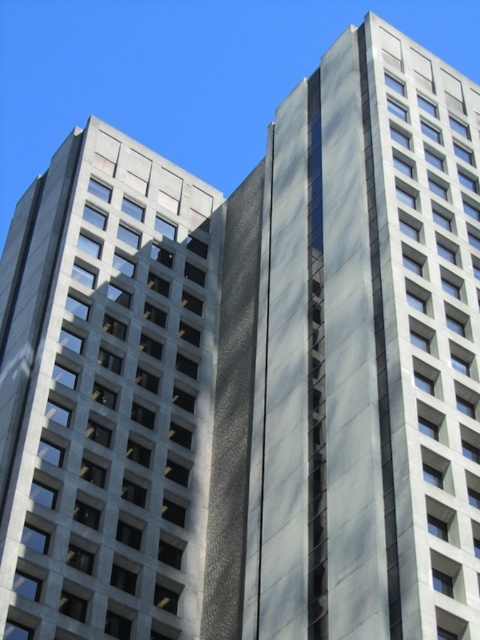
You are an architect planning to install a flagpole on the roof of one of the gray concrete buildings. The flagpole requires a minimum of 10 meters of clearance above the roof to comply with aviation safety regulations. Given that the gray concrete building at center is 120 meters tall and the gray concrete building at left is 110 meters tall, which building should you choose to install the flagpole?

The gray concrete building at center is taller than the gray concrete building at left. Since the building at center is 120 meters tall, installing the flagpole there would provide the required 10 meters of clearance above the roof for aviation safety regulations.

You are standing in front of the two gray concrete buildings. Which building, the gray concrete building at center or the gray concrete building at left, is closer to you?

The gray concrete building at center is closer to you because it is in front of the gray concrete building at left.

You are standing at the origin point in the image. Which direction should you move to reach the gray concrete building at center?

The gray concrete building at center is located at point 2D coordinates of 0.553 on the x axis and 0.767 on the y axis. Since you are at the origin point, you should move towards the right and upwards to reach it.